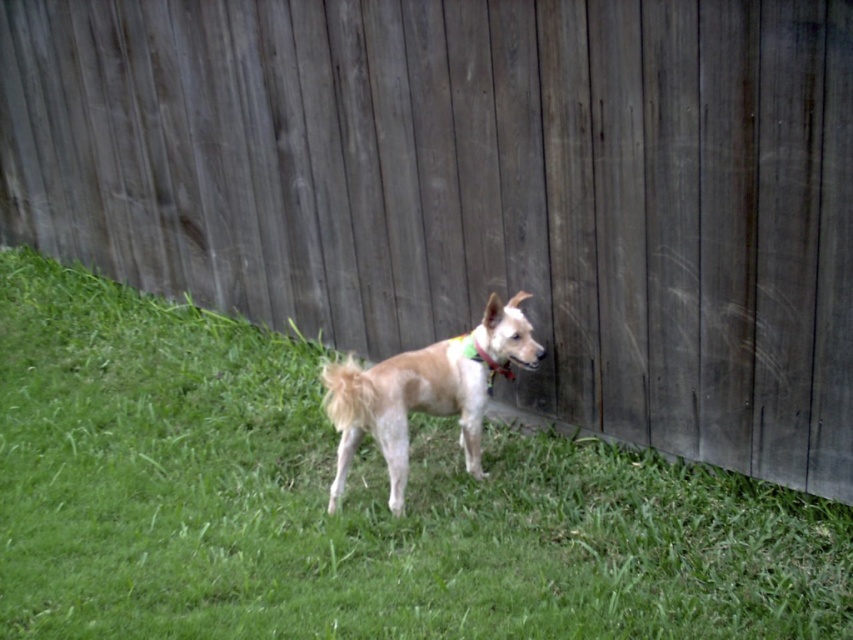
Is green grass at center wider than fuzzy tan dog at center?

Yes, green grass at center is wider than fuzzy tan dog at center.

Can you confirm if green grass at center is bigger than fuzzy tan dog at center?

Yes.

At what (x,y) coordinates should I click in order to perform the action: click on green grass at center. Please return your answer as a coordinate pair (x, y). The width and height of the screenshot is (853, 640). Looking at the image, I should click on (347, 502).

Image resolution: width=853 pixels, height=640 pixels. I want to click on green grass at center, so [347, 502].

Does fuzzy tan dog at center have a greater height compared to multicolored fabric neckband at center?

Yes, fuzzy tan dog at center is taller than multicolored fabric neckband at center.

In the scene shown: How far apart are fuzzy tan dog at center and multicolored fabric neckband at center?

fuzzy tan dog at center and multicolored fabric neckband at center are 12.25 inches apart from each other.

Is point (431, 349) farther from camera compared to point (489, 360)?

No.

The height and width of the screenshot is (640, 853). I want to click on fuzzy tan dog at center, so click(403, 406).

Can you confirm if green grass at center is thinner than multicolored fabric neckband at center?

Incorrect, green grass at center's width is not less than multicolored fabric neckband at center's.

Measure the distance between point (45, 547) and camera.

Point (45, 547) and camera are 9.49 feet apart.

Is point (776, 586) positioned in front of point (488, 362)?

Yes, point (776, 586) is in front of point (488, 362).

At what (x,y) coordinates should I click in order to perform the action: click on green grass at center. Please return your answer as a coordinate pair (x, y). Looking at the image, I should click on (347, 502).